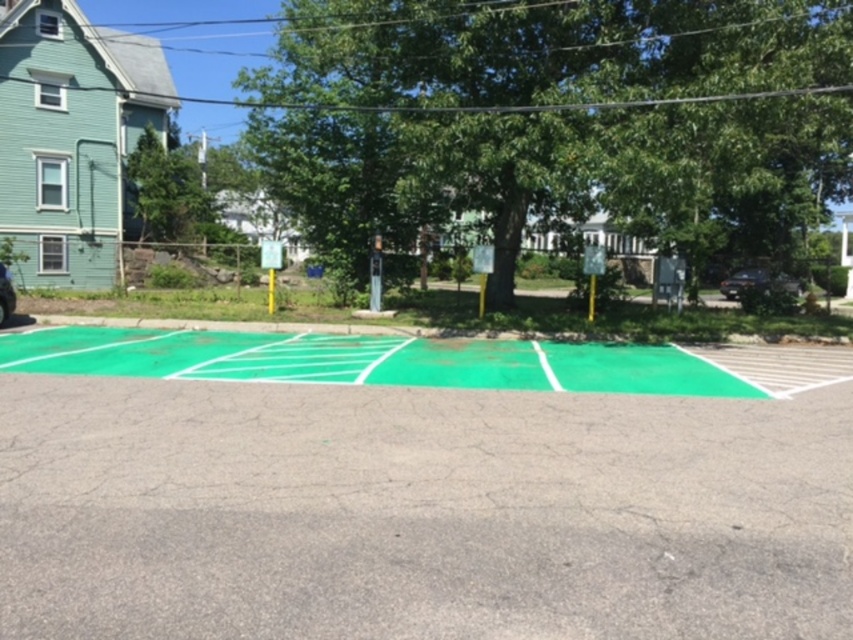
Question: Which of the following is the farthest from the observer?

Choices:
 (A) (3, 289)
 (B) (277, 600)
 (C) (432, 113)

Answer: (A)

Question: Can you confirm if shiny black car at right is positioned to the left of shiny blue car at left?

Choices:
 (A) no
 (B) yes

Answer: (A)

Question: Is shiny black car at right further to camera compared to shiny blue car at left?

Choices:
 (A) no
 (B) yes

Answer: (B)

Question: Considering the real-world distances, which object is closest to the green leafy tree at center?

Choices:
 (A) shiny blue car at left
 (B) shiny black car at right
 (C) green painted court at center

Answer: (C)

Question: Can you confirm if green painted court at center is smaller than shiny blue car at left?

Choices:
 (A) yes
 (B) no

Answer: (A)

Question: Which of the following is the farthest from the observer?

Choices:
 (A) (4, 298)
 (B) (289, 120)

Answer: (B)